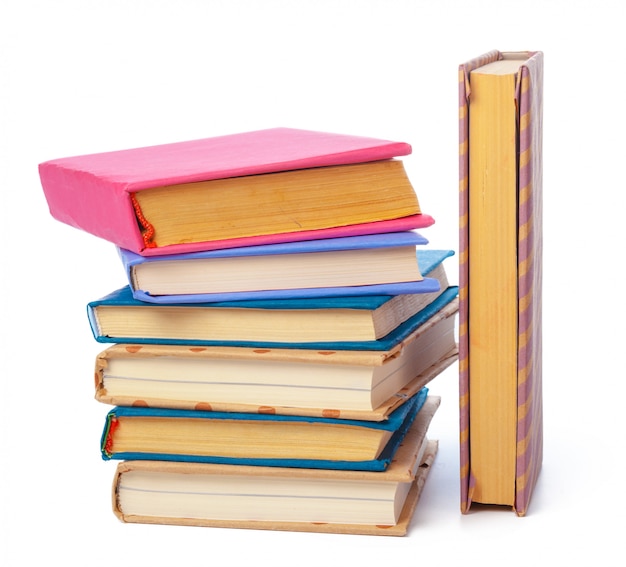
Find the location of a particular element. The width and height of the screenshot is (626, 567). books is located at coordinates (491, 281), (327, 217), (330, 263), (312, 319), (313, 378), (285, 443), (280, 489).